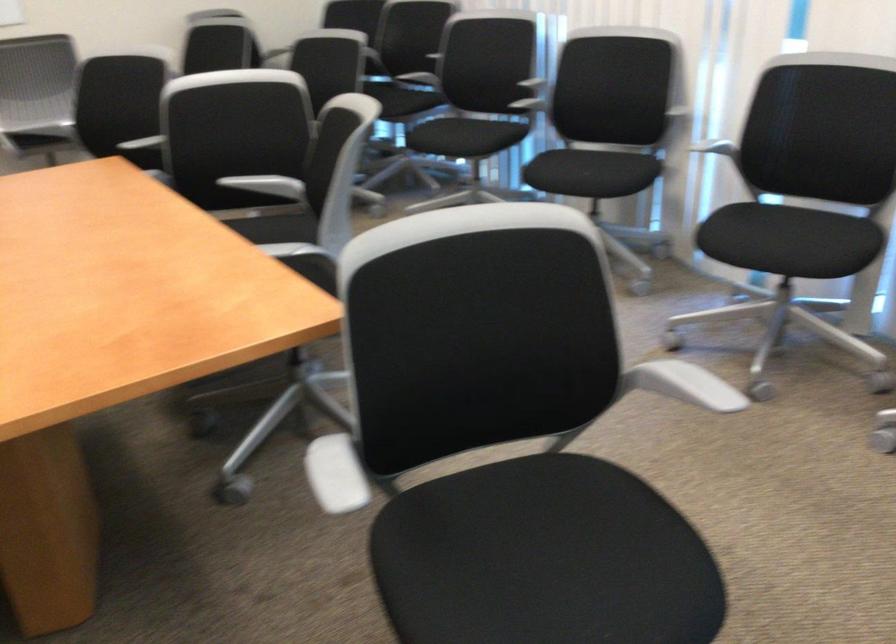
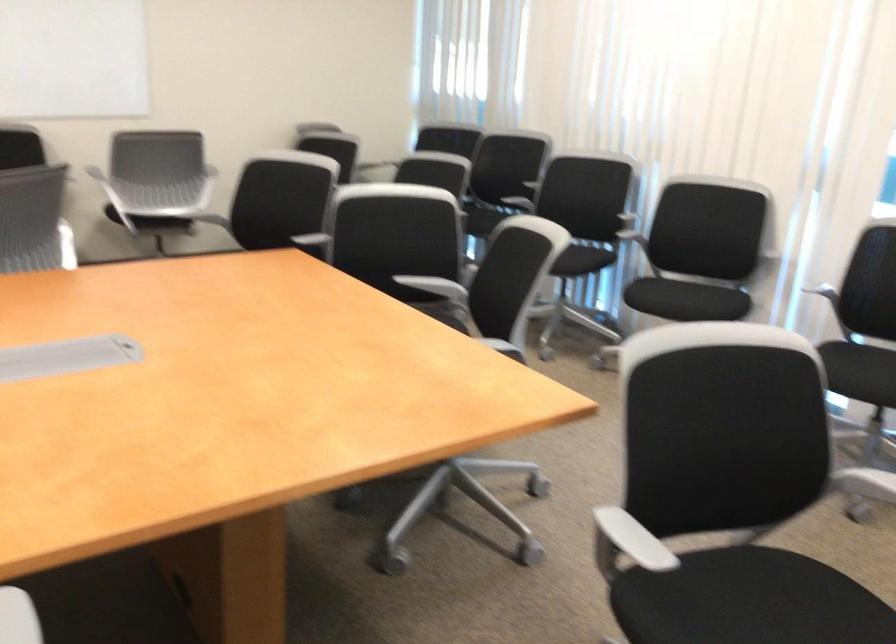
What movement of the cameraman would produce the second image?

The cameraman moved toward left, backward.